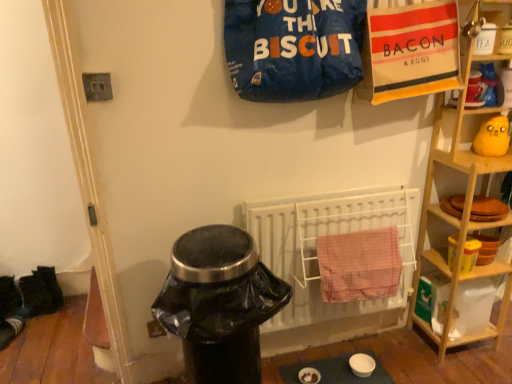
This screenshot has width=512, height=384. Find the location of `free space between wooden shelf at right and matte blue table at lower center`. free space between wooden shelf at right and matte blue table at lower center is located at coordinates (394, 352).